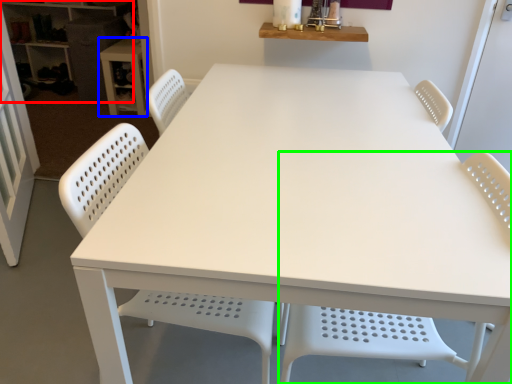
Question: Which object is the closest to the shelf (highlighted by a red box)? Choose among these: table (highlighted by a blue box) or chair (highlighted by a green box).

Choices:
 (A) table
 (B) chair

Answer: (A)